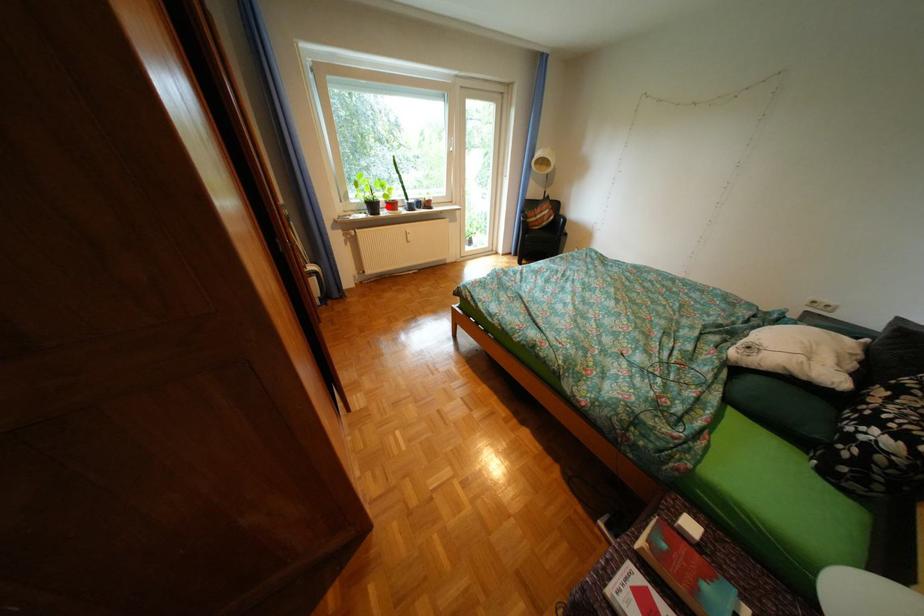
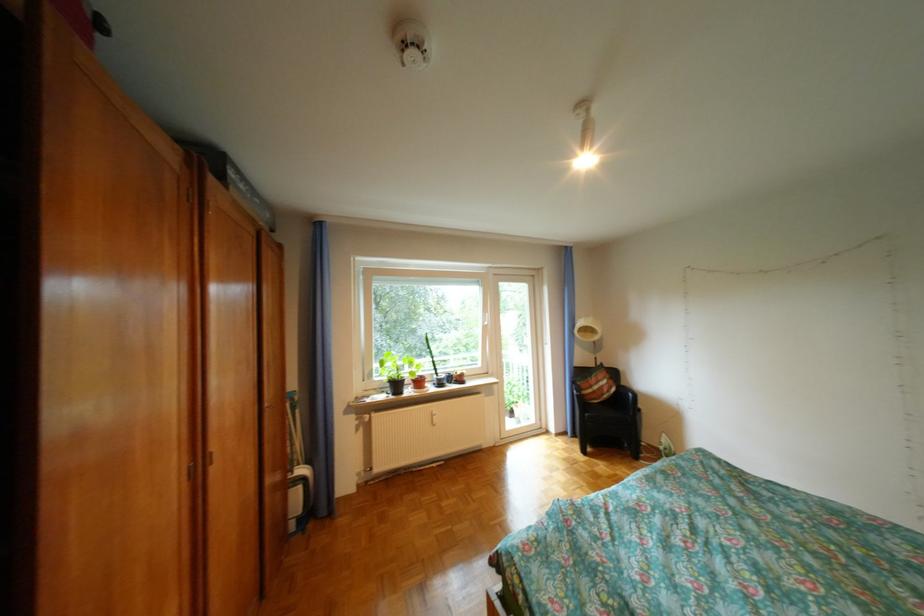
Where in the second image is the point corresponding to the highlighted location from the first image?

(410, 386)